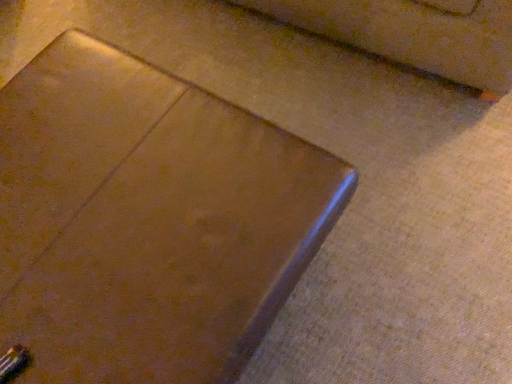
Measure the distance between metallic square tray at center and camera.

The distance of metallic square tray at center from camera is 32.16 inches.

The width and height of the screenshot is (512, 384). Find the location of `metallic square tray at center`. metallic square tray at center is located at coordinates (147, 221).

The width and height of the screenshot is (512, 384). Describe the element at coordinates (147, 221) in the screenshot. I see `metallic square tray at center` at that location.

Find the location of a particular element. Image resolution: width=512 pixels, height=384 pixels. metallic square tray at center is located at coordinates (147, 221).